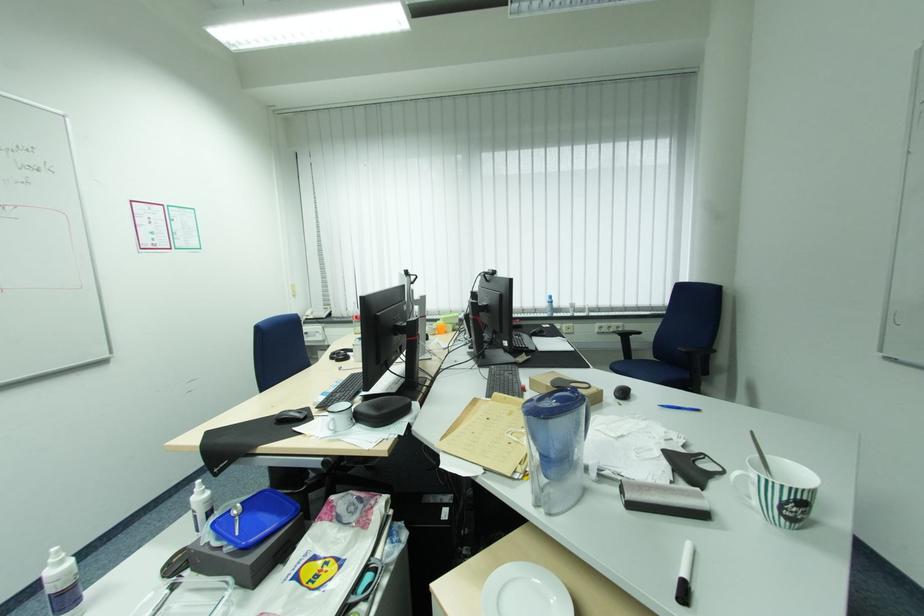
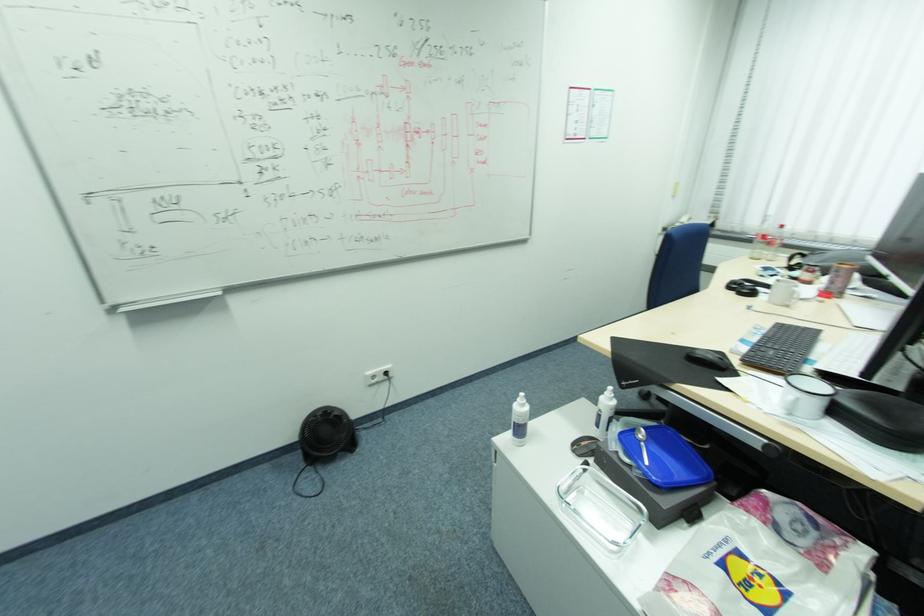
The point at (286, 418) is marked in the first image. Where is the corresponding point in the second image?

(699, 355)